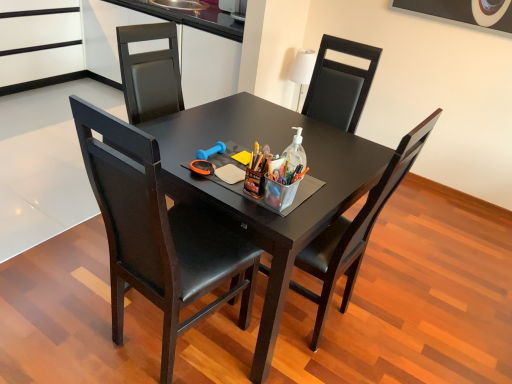
At what (x,y) coordinates should I click in order to perform the action: click on space that is in front of translucent plastic bottle at center. Please return your answer as a coordinate pair (x, y). This screenshot has width=512, height=384. Looking at the image, I should click on (298, 197).